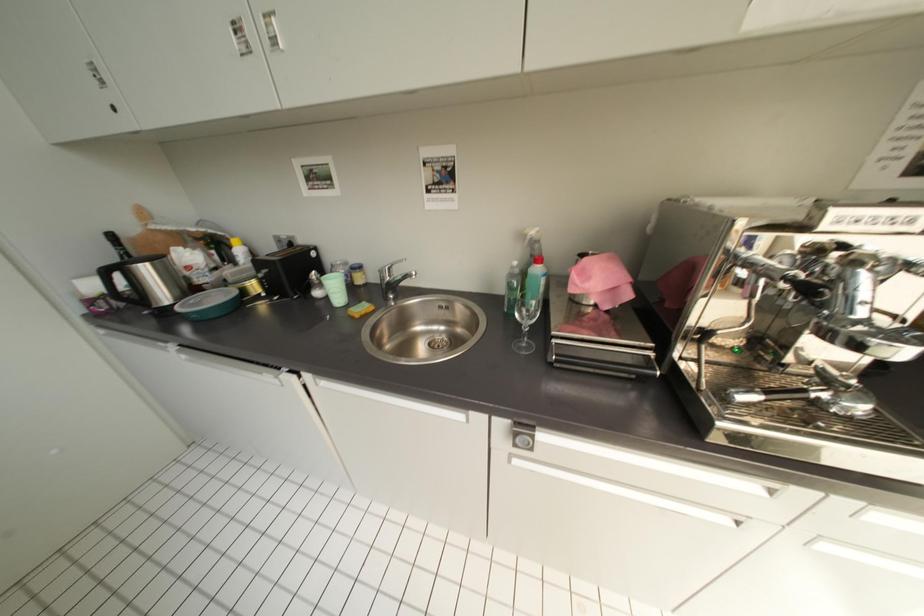
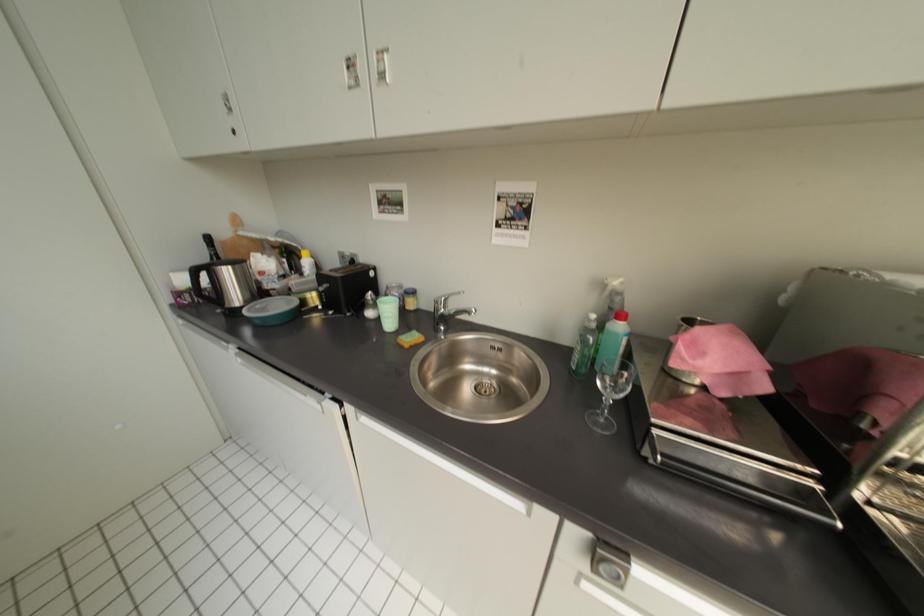
In a continuous first-person perspective shot, in which direction is the camera moving?

The cameraman moved toward left, forward.